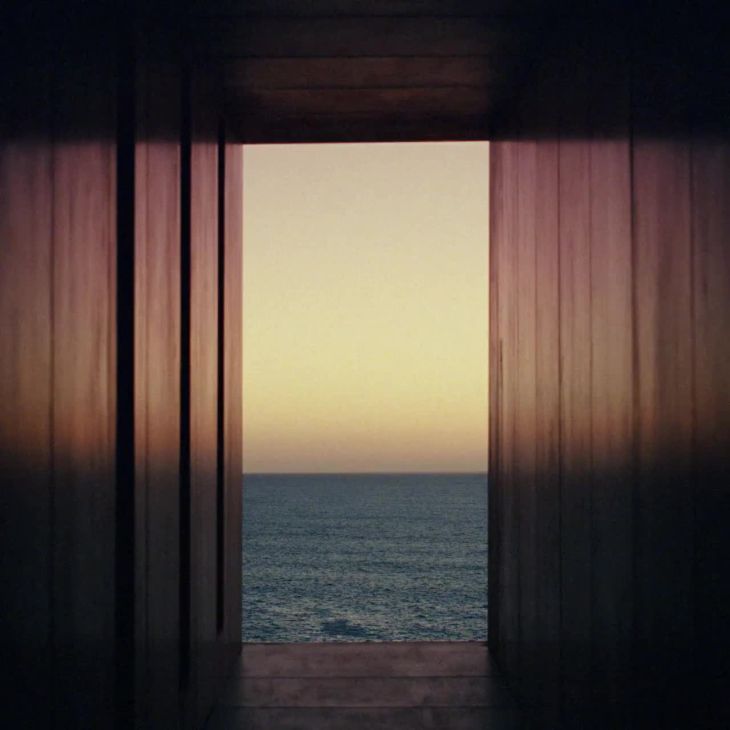
The height and width of the screenshot is (730, 730). I want to click on gaps in wall surface, so click(x=120, y=420), click(x=187, y=534), click(x=220, y=510).